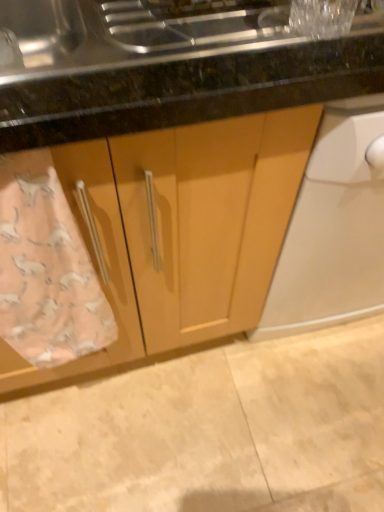
Question: Is pink fabric towel at lower left beside matte wood cabinet at center?

Choices:
 (A) no
 (B) yes

Answer: (A)

Question: Is pink fabric towel at lower left taller than matte wood cabinet at center?

Choices:
 (A) yes
 (B) no

Answer: (B)

Question: Can you confirm if pink fabric towel at lower left is smaller than matte wood cabinet at center?

Choices:
 (A) yes
 (B) no

Answer: (A)

Question: Does pink fabric towel at lower left have a lesser width compared to matte wood cabinet at center?

Choices:
 (A) yes
 (B) no

Answer: (A)

Question: Is matte wood cabinet at center a part of pink fabric towel at lower left?

Choices:
 (A) yes
 (B) no

Answer: (B)

Question: Would you say pink fabric towel at lower left is a long distance from matte wood cabinet at center?

Choices:
 (A) no
 (B) yes

Answer: (A)

Question: Is beige tile floor at lower center bigger than pink fabric towel at lower left?

Choices:
 (A) yes
 (B) no

Answer: (A)

Question: Is beige tile floor at lower center completely or partially outside of pink fabric towel at lower left?

Choices:
 (A) no
 (B) yes

Answer: (B)

Question: Is beige tile floor at lower center shorter than pink fabric towel at lower left?

Choices:
 (A) yes
 (B) no

Answer: (A)

Question: Does beige tile floor at lower center have a greater height compared to pink fabric towel at lower left?

Choices:
 (A) no
 (B) yes

Answer: (A)

Question: Is beige tile floor at lower center turned away from pink fabric towel at lower left?

Choices:
 (A) no
 (B) yes

Answer: (A)

Question: Can you confirm if beige tile floor at lower center is wider than pink fabric towel at lower left?

Choices:
 (A) yes
 (B) no

Answer: (A)

Question: Is pink fabric towel at lower left beside beige tile floor at lower center?

Choices:
 (A) yes
 (B) no

Answer: (B)